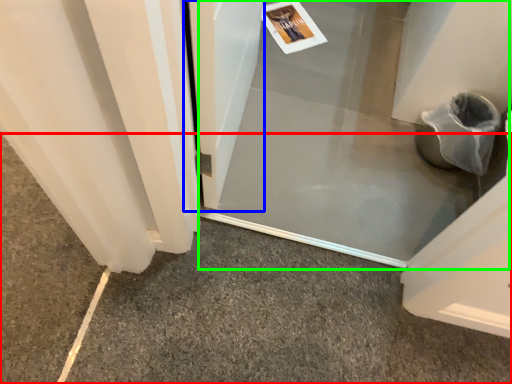
Question: Based on their relative distances, which object is farther from concrete (highlighted by a red box)? Choose from screen door (highlighted by a blue box) and screen door (highlighted by a green box).

Choices:
 (A) screen door
 (B) screen door

Answer: (A)